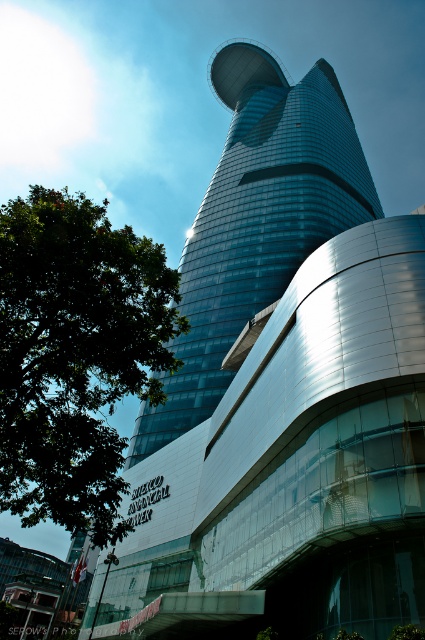
You are standing in front of the BITEXCO FINANCIAL TOWER and notice a green leafy tree at left and a shiny glass tower at center. Which object is shorter?

The green leafy tree at left is shorter than the shiny glass tower at center.